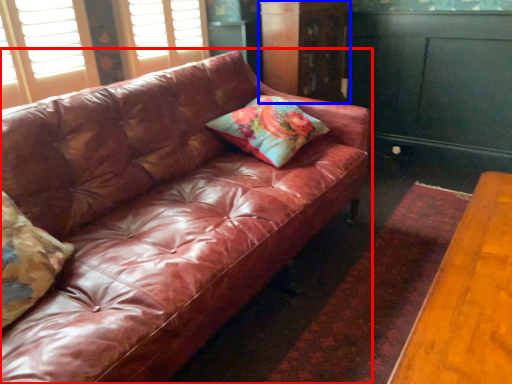
Question: Among these objects, which one is nearest to the camera, studio couch (highlighted by a red box) or dresser (highlighted by a blue box)?

Choices:
 (A) studio couch
 (B) dresser

Answer: (A)